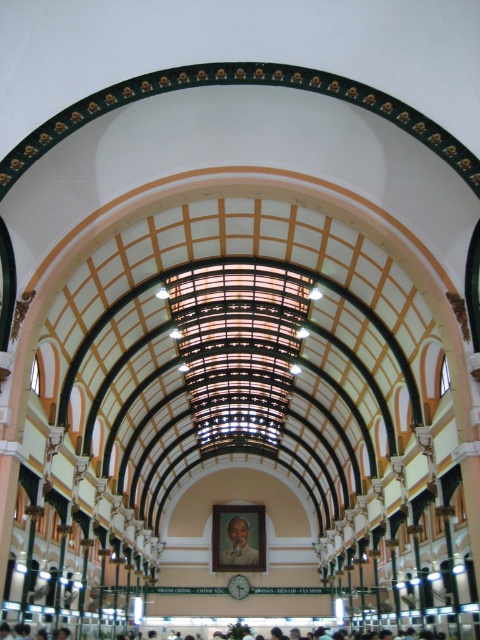
Question: From the image, what is the correct spatial relationship of smooth skin person at center in relation to smooth brown portrait at center?

Choices:
 (A) above
 (B) below

Answer: (A)

Question: From the image, what is the correct spatial relationship of smooth skin person at center in relation to smooth brown portrait at center?

Choices:
 (A) above
 (B) below

Answer: (A)

Question: Which object appears closest to the camera in this image?

Choices:
 (A) smooth skin person at center
 (B) smooth brown portrait at center

Answer: (A)

Question: Does smooth skin person at center appear under smooth brown portrait at center?

Choices:
 (A) no
 (B) yes

Answer: (A)